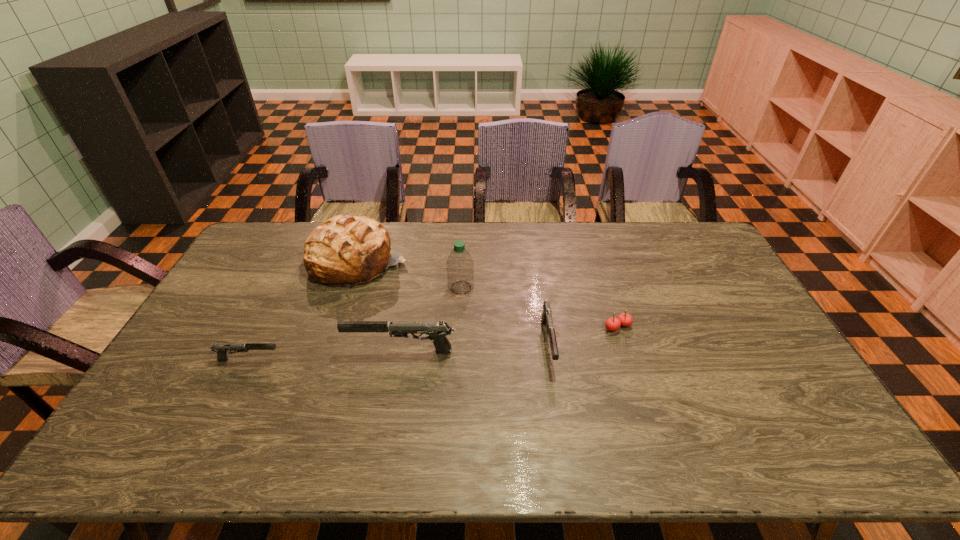
Find the location of a particular element. This screenshot has width=960, height=540. the leftmost gun is located at coordinates (222, 349).

Where is `the second gun from left to right`? Image resolution: width=960 pixels, height=540 pixels. the second gun from left to right is located at coordinates (437, 330).

Identify the location of the tallest gun. (437, 330).

In order to click on the fourth tallest object in this screenshot , I will do `click(546, 317)`.

The image size is (960, 540). I want to click on the rightmost gun, so click(546, 317).

Identify the location of bread. (344, 251).

Identify the location of water bottle. (460, 267).

The width and height of the screenshot is (960, 540). Find the location of `the rightmost object`. the rightmost object is located at coordinates (612, 324).

This screenshot has width=960, height=540. Identify the location of free space located 0.160m at the muzzle end of the shortest gun. tap(338, 360).

You are a GUI agent. You are given a task and a screenshot of the screen. Output one action in this format:
    pyautogui.click(x=<x>, y=<y>)
    Task: Click on the vacant point located 0.120m at the muzzle end of the second gun from left to right
    The width and height of the screenshot is (960, 540).
    Given the screenshot: What is the action you would take?
    pyautogui.click(x=304, y=352)